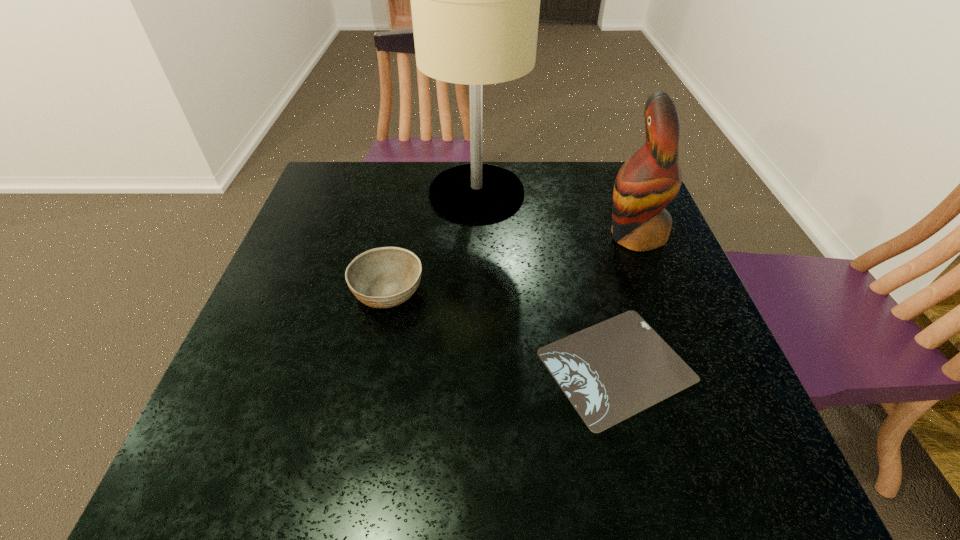
Identify the location of empty space that is in between the parrot and the mousepad. (625, 300).

The height and width of the screenshot is (540, 960). Identify the location of vacant area between the mousepad and the parrot. (625, 300).

I want to click on empty location between the tallest object and the mousepad, so click(546, 279).

Locate an element on the screen. blank region between the second shortest object and the tallest object is located at coordinates (432, 242).

The image size is (960, 540). I want to click on free space that is in between the mousepad and the bowl, so click(x=502, y=328).

The image size is (960, 540). I want to click on blank region between the shortest object and the tallest object, so click(x=546, y=279).

Identify the location of free space between the mousepad and the table lamp. The width and height of the screenshot is (960, 540). (546, 279).

Locate an element on the screen. The height and width of the screenshot is (540, 960). free spot between the parrot and the bowl is located at coordinates (512, 263).

What are the coordinates of `object that is the third closest to the tallest object` in the screenshot? It's located at (609, 372).

Locate an element on the screen. This screenshot has height=540, width=960. object that ranks as the second closest to the third tallest object is located at coordinates (609, 372).